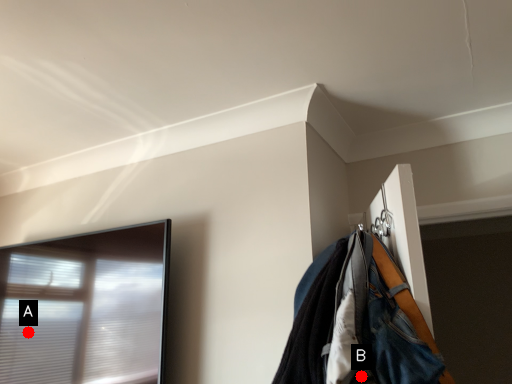
Question: Two points are circled on the image, labeled by A and B beside each circle. Among these points, which one is farthest from the camera?

Choices:
 (A) A is further
 (B) B is further

Answer: (A)